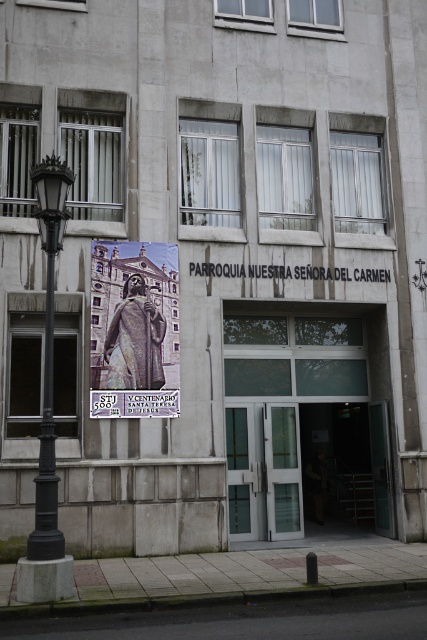
Question: Can you confirm if matte bronze statue at center is bigger than black cast iron streetlight at left?

Choices:
 (A) no
 (B) yes

Answer: (B)

Question: Does matte bronze statue at center appear under black cast iron streetlight at left?

Choices:
 (A) yes
 (B) no

Answer: (B)

Question: Can you confirm if matte bronze statue at center is wider than black cast iron streetlight at left?

Choices:
 (A) yes
 (B) no

Answer: (A)

Question: Among these points, which one is nearest to the camera?

Choices:
 (A) (49, 243)
 (B) (107, 387)

Answer: (A)

Question: Among these objects, which one is nearest to the camera?

Choices:
 (A) matte bronze statue at center
 (B) black cast iron streetlight at left

Answer: (B)